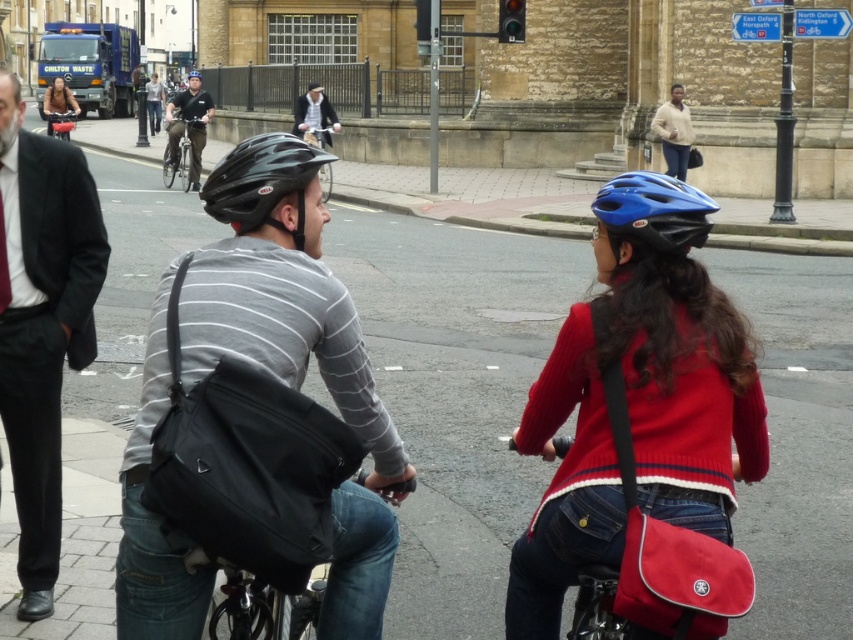
Can you confirm if shiny silver bicycle at upper left is taller than light gray striped shirt at center?

In fact, shiny silver bicycle at upper left may be shorter than light gray striped shirt at center.

From the picture: Who is positioned more to the left, shiny silver bicycle at upper left or light gray striped shirt at center?

light gray striped shirt at center

Measure the distance between shiny silver bicycle at upper left and camera.

shiny silver bicycle at upper left is 83.85 feet from camera.

You are a GUI agent. You are given a task and a screenshot of the screen. Output one action in this format:
    pyautogui.click(x=<x>, y=<y>)
    Task: Click on the shiny silver bicycle at upper left
    
    Given the screenshot: What is the action you would take?
    pyautogui.click(x=183, y=152)

Is matte red sweater at center taller than matte black helmet at center?

In fact, matte red sweater at center may be shorter than matte black helmet at center.

Between matte red sweater at center and matte black helmet at center, which one appears on the left side from the viewer's perspective?

matte black helmet at center is more to the left.

The width and height of the screenshot is (853, 640). Find the location of `matte red sweater at center`. matte red sweater at center is located at coordinates (643, 429).

In the scene shown: Is red fabric bag at lower right taller than blue matte helmet at upper right?

Indeed, red fabric bag at lower right has a greater height compared to blue matte helmet at upper right.

Is red fabric bag at lower right closer to the viewer compared to blue matte helmet at upper right?

Yes, it is in front of blue matte helmet at upper right.

Between point (508, 620) and point (640, 186), which one is positioned in front?

Point (640, 186) is in front.

Identify the location of red fabric bag at lower right. This screenshot has height=640, width=853. (561, 556).